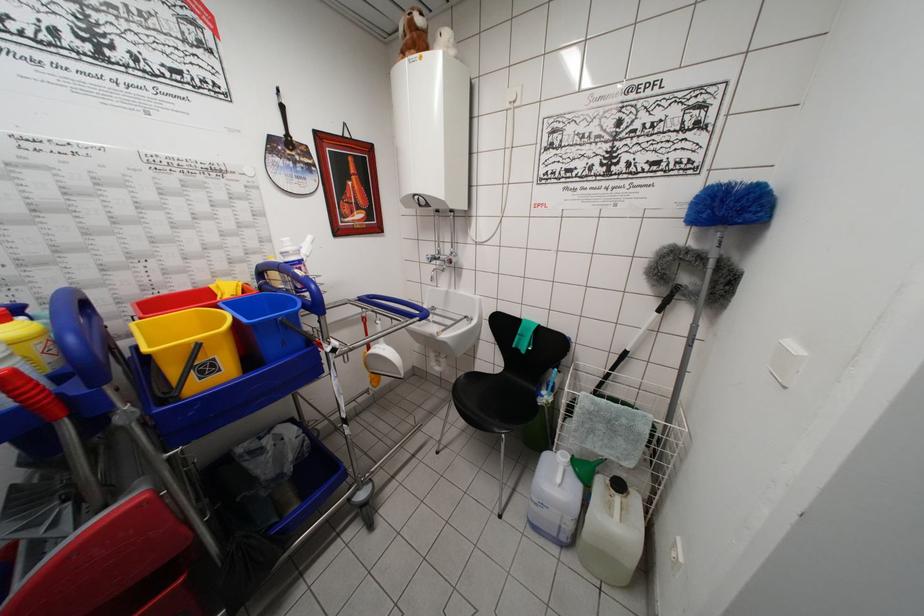
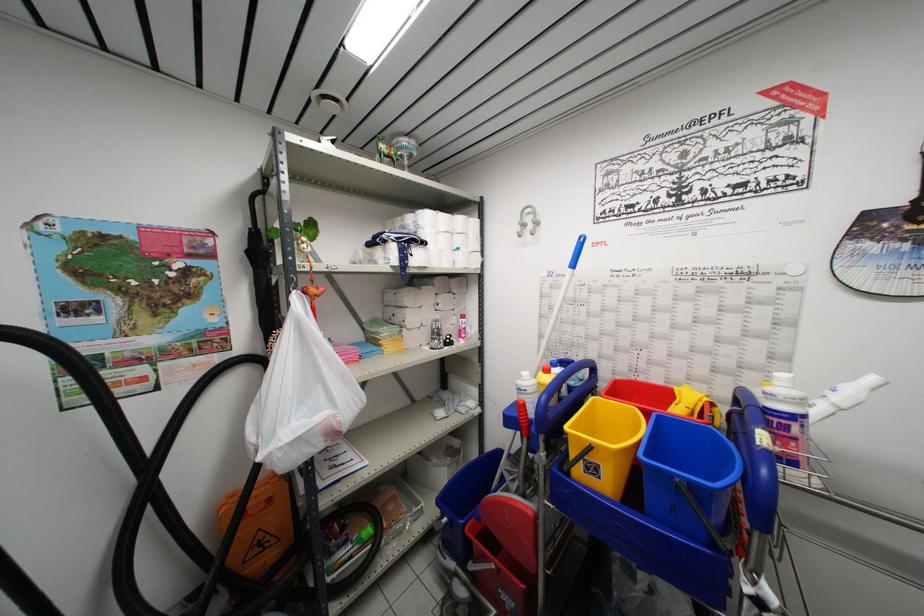
Question: Based on the continuous images, in which direction is the camera rotating? Reply with the corresponding letter.

Choices:
 (A) Left
 (B) Right
 (C) Up
 (D) Down

Answer: (A)